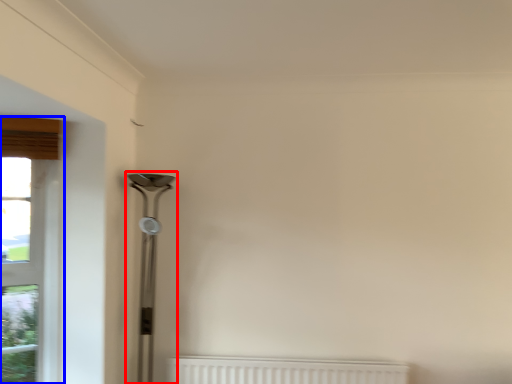
Question: Among these objects, which one is nearest to the camera, table lamp (highlighted by a red box) or window (highlighted by a blue box)?

Choices:
 (A) table lamp
 (B) window

Answer: (B)